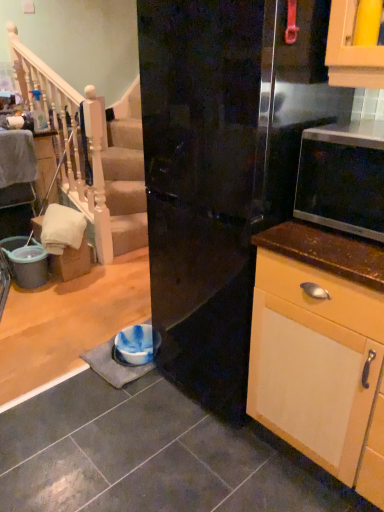
Identify the location of unoccupied area in front of glossy black refrigerator at center. (205, 465).